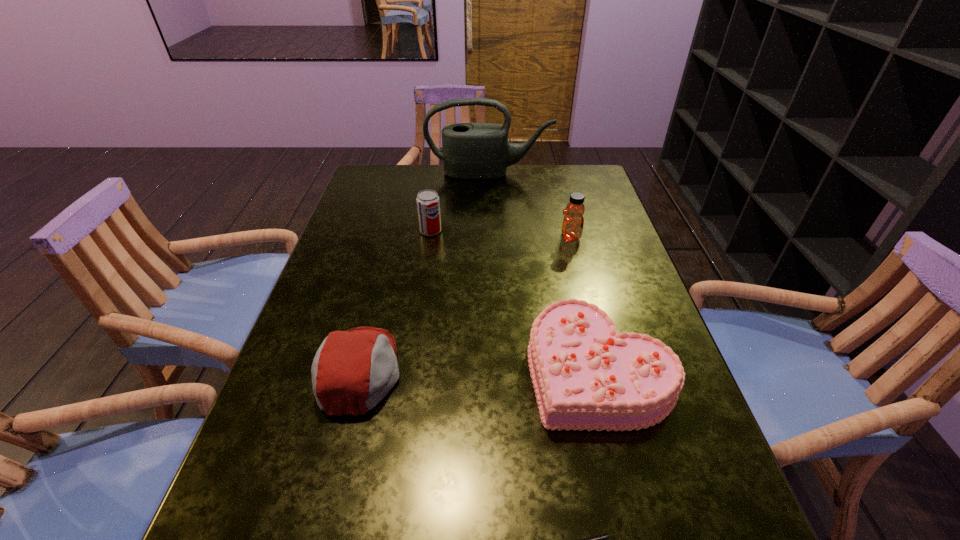
This screenshot has height=540, width=960. In order to click on free space located 0.320m on the back of the soda in this screenshot , I will do `click(440, 171)`.

The height and width of the screenshot is (540, 960). I want to click on vacant area situated on the front-facing side of the cap, so click(x=560, y=371).

Identify the location of vacant area situated on the back of the cake. (564, 230).

Where is `object at the far edge`? object at the far edge is located at coordinates (470, 150).

In order to click on object that is at the left edge in this screenshot , I will do `click(353, 370)`.

At what (x,y) coordinates should I click in order to perform the action: click on watering can that is at the right edge. Please return your answer as a coordinate pair (x, y). This screenshot has width=960, height=540. Looking at the image, I should click on (470, 150).

Where is `honey present at the right edge`? honey present at the right edge is located at coordinates (573, 222).

Identify the location of cake that is at the right edge. This screenshot has width=960, height=540. pyautogui.click(x=585, y=375).

Image resolution: width=960 pixels, height=540 pixels. I want to click on object at the far right corner, so click(x=470, y=150).

Find the location of `vacant space at the far edge of the desktop`. vacant space at the far edge of the desktop is located at coordinates coord(523,166).